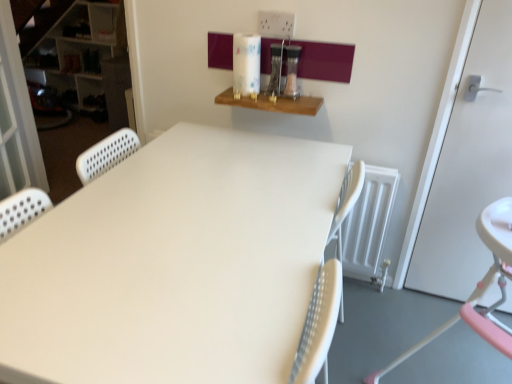
Where is `pink plastic highchair at lower right`? This screenshot has height=384, width=512. pink plastic highchair at lower right is located at coordinates (480, 287).

What do you see at coordinates (273, 103) in the screenshot?
I see `wooden shelf at upper center` at bounding box center [273, 103].

What are the coordinates of `white matte door at right` in the screenshot? It's located at (469, 165).

Identify the location of pink plastic highchair at lower right. [x=480, y=287].

Considering the positions of objects white plastic bookshelf at left and wooden shelf at upper center in the image provided, who is more to the right, white plastic bookshelf at left or wooden shelf at upper center?

wooden shelf at upper center.

Considering the relative sizes of white plastic bookshelf at left and wooden shelf at upper center in the image provided, is white plastic bookshelf at left shorter than wooden shelf at upper center?

No.

How different are the orientations of white perforated screen door at left and white matte table at center in degrees?

156 degrees.

Is white perforated screen door at left oriented away from white matte table at center?

white perforated screen door at left is not turned away from white matte table at center.

Considering the relative sizes of white perforated screen door at left and white matte table at center in the image provided, is white perforated screen door at left wider than white matte table at center?

No.

From the image's perspective, is wooden shelf at upper center positioned above or below white matte table at center?

wooden shelf at upper center is above white matte table at center.

In the scene shown: Is wooden shelf at upper center facing away from white matte table at center?

No, wooden shelf at upper center is not facing the opposite direction of white matte table at center.

Considering the relative sizes of wooden shelf at upper center and white matte table at center in the image provided, is wooden shelf at upper center wider than white matte table at center?

No.

In terms of height, does pink plastic highchair at lower right look taller or shorter compared to white matte door at right?

Considering their sizes, pink plastic highchair at lower right has less height than white matte door at right.

From the image's perspective, is pink plastic highchair at lower right above or below white matte door at right?

Based on their image positions, pink plastic highchair at lower right is located beneath white matte door at right.

Are pink plastic highchair at lower right and white matte door at right far apart?

pink plastic highchair at lower right is actually quite close to white matte door at right.

Does point (509, 213) come closer to viewer compared to point (490, 97)?

That is True.

Considering the relative sizes of white matte door at right and white matte table at center in the image provided, is white matte door at right wider than white matte table at center?

No.

Is white matte door at right oriented away from white matte table at center?

No.

Based on the photo, is white matte door at right in contact with white matte table at center?

No, white matte door at right is not next to white matte table at center.

Is white matte door at right in front of or behind white matte table at center in the image?

white matte door at right is positioned farther from the viewer than white matte table at center.

Can you see pink plastic highchair at lower right touching white perforated screen door at left?

No, pink plastic highchair at lower right is not in contact with white perforated screen door at left.

In the scene shown: Is pink plastic highchair at lower right to the right of white perforated screen door at left from the viewer's perspective?

Correct, you'll find pink plastic highchair at lower right to the right of white perforated screen door at left.

In terms of width, does pink plastic highchair at lower right look wider or thinner when compared to white perforated screen door at left?

pink plastic highchair at lower right is wider than white perforated screen door at left.

Considering the relative sizes of pink plastic highchair at lower right and white perforated screen door at left in the image provided, is pink plastic highchair at lower right taller than white perforated screen door at left?

In fact, pink plastic highchair at lower right may be shorter than white perforated screen door at left.

Is pink plastic highchair at lower right not close to wooden shelf at upper center?

Actually, pink plastic highchair at lower right and wooden shelf at upper center are a little close together.

Which object is positioned more to the right, pink plastic highchair at lower right or wooden shelf at upper center?

pink plastic highchair at lower right.

Is the depth of pink plastic highchair at lower right greater than that of wooden shelf at upper center?

No, it is not.

Choose the correct answer: Is pink plastic highchair at lower right inside wooden shelf at upper center or outside it?

pink plastic highchair at lower right lies outside wooden shelf at upper center.

Locate an element on the screen. This screenshot has height=384, width=512. bookshelf lying on the left of wooden shelf at upper center is located at coordinates (78, 50).

Identify the location of screen door above the white matte table at center (from a real-world perspective). (16, 117).

Looking at the image, which one is located further to wooden shelf at upper center, white perforated screen door at left or white matte door at right?

Based on the image, white perforated screen door at left appears to be further to wooden shelf at upper center.

Which object lies nearer to the anchor point pink plastic highchair at lower right, white perforated screen door at left or white matte door at right?

white matte door at right lies closer to pink plastic highchair at lower right than the other object.

Looking at the image, which one is located further to pink plastic highchair at lower right, wooden shelf at upper center or white matte table at center?

wooden shelf at upper center is positioned further to the anchor pink plastic highchair at lower right.

Based on their spatial positions, is white matte table at center or white perforated screen door at left closer to white matte door at right?

Among the two, white matte table at center is located nearer to white matte door at right.

Looking at the image, which one is located further to white matte door at right, white matte table at center or pink plastic highchair at lower right?

The object further to white matte door at right is white matte table at center.

Based on their spatial positions, is wooden shelf at upper center or white matte door at right closer to white plastic bookshelf at left?

wooden shelf at upper center.

Estimate the real-world distances between objects in this image. Which object is closer to pink plastic highchair at lower right, white matte table at center or white perforated screen door at left?

white matte table at center.

Based on their spatial positions, is white plastic bookshelf at left or wooden shelf at upper center further from white matte table at center?

white plastic bookshelf at left is positioned further to the anchor white matte table at center.

You are a GUI agent. You are given a task and a screenshot of the screen. Output one action in this format:
    pyautogui.click(x=<x>, y=<y>)
    Task: Click on the chair between white plastic bookshelf at left and white matte door at right in the horizontal direction
    This screenshot has width=512, height=384.
    Given the screenshot: What is the action you would take?
    pyautogui.click(x=480, y=287)

At what (x,y) coordinates should I click in order to perform the action: click on screen door located between pink plastic highchair at lower right and white plastic bookshelf at left in the depth direction. Please return your answer as a coordinate pair (x, y). The height and width of the screenshot is (384, 512). Looking at the image, I should click on pos(16,117).

You are a GUI agent. You are given a task and a screenshot of the screen. Output one action in this format:
    pyautogui.click(x=<x>, y=<y>)
    Task: Click on the door between white matte table at center and white plastic bookshelf at left along the z-axis
    The height and width of the screenshot is (384, 512).
    Given the screenshot: What is the action you would take?
    pyautogui.click(x=469, y=165)

Find the location of `chair between white matte table at center and white plastic bookshelf at left along the z-axis`. chair between white matte table at center and white plastic bookshelf at left along the z-axis is located at coordinates 480,287.